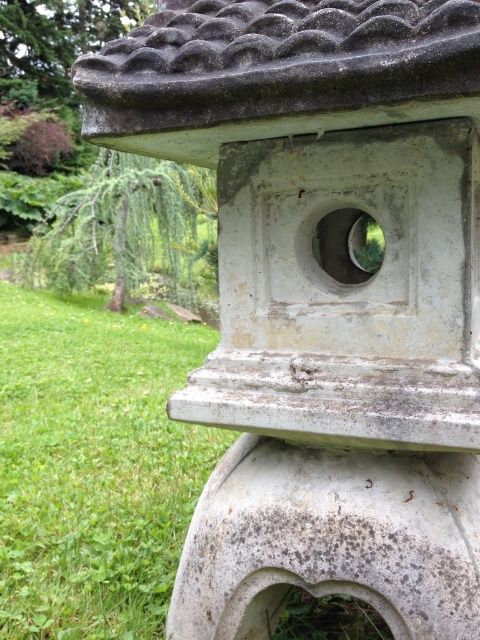
Is point (170, 557) behind point (362, 588)?

Yes, point (170, 557) is behind point (362, 588).

Can you confirm if green grass at lower left is positioned above gray stone lantern at center?

No.

You are a GUI agent. You are given a task and a screenshot of the screen. Output one action in this format:
    pyautogui.click(x=<x>, y=<y>)
    Task: Click on the green grass at lower left
    
    Given the screenshot: What is the action you would take?
    pyautogui.click(x=94, y=467)